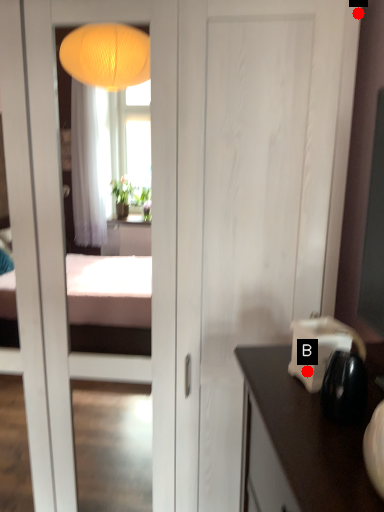
Question: Two points are circled on the image, labeled by A and B beside each circle. Among these points, which one is farthest from the camera?

Choices:
 (A) A is further
 (B) B is further

Answer: (A)